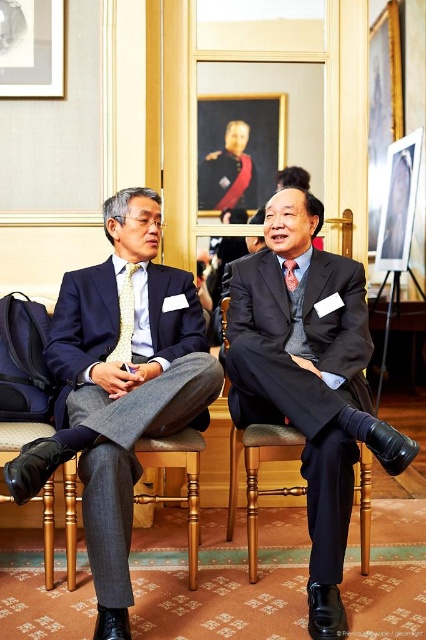
Question: Can you confirm if yellowtexturetie at center is smaller than red silk tie at center?

Choices:
 (A) no
 (B) yes

Answer: (A)

Question: Considering the real-world distances, which object is closest to the red silk tie at center?

Choices:
 (A) matte black suit at center
 (B) wooden chair at center

Answer: (A)

Question: Is oil painting at upper center bigger than red silk tie at center?

Choices:
 (A) yes
 (B) no

Answer: (A)

Question: Which point is farther to the camera?

Choices:
 (A) wooden chair at center
 (B) red silk tie at center

Answer: (B)

Question: Is yellowtexturetie at center further to camera compared to red silk tie at center?

Choices:
 (A) yes
 (B) no

Answer: (B)

Question: Which point appears farthest from the camera in this image?

Choices:
 (A) (204, 396)
 (B) (296, 262)
 (C) (259, 144)
 (D) (126, 356)

Answer: (C)